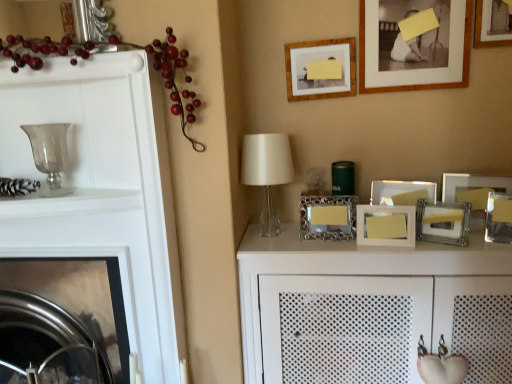
At what (x,y) coordinates should I click in order to perform the action: click on glossy plastic berries at left. Please return your answer as a coordinate pair (x, y). The width and height of the screenshot is (512, 384). Looking at the image, I should click on (174, 81).

Image resolution: width=512 pixels, height=384 pixels. Describe the element at coordinates (354, 303) in the screenshot. I see `white textured cabinet at center` at that location.

This screenshot has height=384, width=512. What do you see at coordinates (398, 190) in the screenshot?
I see `metallic silver picture frame at center-right, the sixth picture frame ordered from the bottom` at bounding box center [398, 190].

Image resolution: width=512 pixels, height=384 pixels. I want to click on wooden picture frame at upper right, positioned as the first picture frame in top-to-bottom order, so click(x=493, y=23).

You are a GUI agent. You are given a task and a screenshot of the screen. Output one action in this format:
    pyautogui.click(x=<x>, y=<y>)
    Task: Click on the glossy plastic berries at left
    The image size is (512, 384).
    Given the screenshot: What is the action you would take?
    pyautogui.click(x=174, y=81)

Between wooden picture frame at upper center, marked as the 7th picture frame in a bottom-to-top arrangement, and transparent glass table lamp at center, which one has larger size?

transparent glass table lamp at center is bigger.

Does wooden picture frame at upper center, arranged as the third picture frame when viewed from the top, turn towards transparent glass table lamp at center?

No, wooden picture frame at upper center, arranged as the third picture frame when viewed from the top, is not oriented towards transparent glass table lamp at center.

Are wooden picture frame at upper center, marked as the 7th picture frame in a bottom-to-top arrangement, and transparent glass table lamp at center making contact?

wooden picture frame at upper center, marked as the 7th picture frame in a bottom-to-top arrangement, and transparent glass table lamp at center are not in contact.

Which of these two, wooden picture frame at upper center, marked as the 7th picture frame in a bottom-to-top arrangement, or transparent glass table lamp at center, stands shorter?

wooden picture frame at upper center, marked as the 7th picture frame in a bottom-to-top arrangement, is shorter.

The height and width of the screenshot is (384, 512). Find the location of `vanity below the transparent glass table lamp at center (from the image's perspective)`. vanity below the transparent glass table lamp at center (from the image's perspective) is located at coordinates (354, 303).

Which of these two, transparent glass table lamp at center or white textured cabinet at center, is wider?

white textured cabinet at center is wider.

From a real-world perspective, is transparent glass table lamp at center under white textured cabinet at center?

→ No, from a real-world perspective, transparent glass table lamp at center is not under white textured cabinet at center.

In the image, is transparent glass table lamp at center positioned in front of or behind white textured cabinet at center?

transparent glass table lamp at center is behind white textured cabinet at center.

Identify the location of the 3rd picture frame behind the wooden picture frame at center-right, the 9th picture frame from the top, counting from the anchor's position. The width and height of the screenshot is (512, 384). (414, 84).

What's the angular difference between wooden picture frame at upper right, arranged as the second picture frame when viewed from the top, and wooden picture frame at center-right, which is the first picture frame in bottom-to-top order,'s facing directions?

The angular difference between wooden picture frame at upper right, arranged as the second picture frame when viewed from the top, and wooden picture frame at center-right, which is the first picture frame in bottom-to-top order, is 8.39 degrees.

From the image's perspective, which one is positioned lower, wooden picture frame at upper right, arranged as the second picture frame when viewed from the top, or wooden picture frame at center-right, the 9th picture frame from the top?

wooden picture frame at center-right, the 9th picture frame from the top, is shown below in the image.

Is wooden picture frame at upper right, the 8th picture frame positioned from the bottom, positioned before wooden picture frame at center-right, which is the first picture frame in bottom-to-top order?

No, the depth of wooden picture frame at upper right, the 8th picture frame positioned from the bottom, is greater than that of wooden picture frame at center-right, which is the first picture frame in bottom-to-top order.

Can you confirm if glossy plastic berries at left is shorter than wooden picture frame at upper right, arranged as the second picture frame when viewed from the top?

No.

From a real-world perspective, relative to wooden picture frame at upper right, the 8th picture frame positioned from the bottom, is glossy plastic berries at left vertically above or below?

Clearly, from a real-world perspective, glossy plastic berries at left is below wooden picture frame at upper right, the 8th picture frame positioned from the bottom.

Considering the points (32, 39) and (463, 85), which point is behind, point (32, 39) or point (463, 85)?

The point (463, 85) is farther.

Is glossy plastic berries at left oriented away from wooden picture frame at upper right, arranged as the second picture frame when viewed from the top?

That's not correct — glossy plastic berries at left is not looking away from wooden picture frame at upper right, arranged as the second picture frame when viewed from the top.

Is wooden picture frame at upper right, arranged as the second picture frame when viewed from the top, completely or partially inside wooden picture frame at upper right, placed as the ninth picture frame when sorted from bottom to top?

No.

Between wooden picture frame at upper right, placed as the ninth picture frame when sorted from bottom to top, and wooden picture frame at upper right, the 8th picture frame positioned from the bottom, which one has smaller width?

wooden picture frame at upper right, the 8th picture frame positioned from the bottom, is thinner.

Does wooden picture frame at upper right, placed as the ninth picture frame when sorted from bottom to top, come behind wooden picture frame at upper right, the 8th picture frame positioned from the bottom?

No, wooden picture frame at upper right, placed as the ninth picture frame when sorted from bottom to top, is closer to the camera.

In the scene shown: Can you confirm if wooden picture frame at upper right, positioned as the first picture frame in top-to-bottom order, is positioned to the right of wooden picture frame at upper right, the 8th picture frame positioned from the bottom?

Yes, wooden picture frame at upper right, positioned as the first picture frame in top-to-bottom order, is to the right of wooden picture frame at upper right, the 8th picture frame positioned from the bottom.

Considering the positions of objects transparent glass table lamp at center and wooden picture frame at upper center, arranged as the third picture frame when viewed from the top, in the image provided, who is more to the right, transparent glass table lamp at center or wooden picture frame at upper center, arranged as the third picture frame when viewed from the top,?

From the viewer's perspective, wooden picture frame at upper center, arranged as the third picture frame when viewed from the top, appears more on the right side.

From the image's perspective, is transparent glass table lamp at center beneath wooden picture frame at upper center, arranged as the third picture frame when viewed from the top?

Yes, from the image's perspective, transparent glass table lamp at center is beneath wooden picture frame at upper center, arranged as the third picture frame when viewed from the top.

Based on the photo, is transparent glass table lamp at center next to wooden picture frame at upper center, arranged as the third picture frame when viewed from the top?

There is a gap between transparent glass table lamp at center and wooden picture frame at upper center, arranged as the third picture frame when viewed from the top.

Where is `candle holder on the right of metallic silver fireplace at left`? This screenshot has height=384, width=512. candle holder on the right of metallic silver fireplace at left is located at coordinates (x=49, y=154).

Based on the photo, from the image's perspective, which is above, metallic silver fireplace at left or transparent glass candle holder at left?

transparent glass candle holder at left.

From a real-world perspective, which object rests below the other?

metallic silver fireplace at left, from a real-world perspective.

Is metallic silver fireplace at left inside the boundaries of transparent glass candle holder at left, or outside?

metallic silver fireplace at left exists outside the volume of transparent glass candle holder at left.

The image size is (512, 384). Identify the location of table lamp below the wooden picture frame at upper center, arranged as the third picture frame when viewed from the top (from a real-world perspective). (267, 172).

The width and height of the screenshot is (512, 384). I want to click on vanity that is on the right side of transparent glass table lamp at center, so click(x=354, y=303).

Based on the photo, estimate the real-world distances between objects in this image. Which object is closer to metallic silver picture frame at center-right, which is the fourth picture frame in top-to-bottom order, wooden picture frame at upper center, marked as the 7th picture frame in a bottom-to-top arrangement, or transparent glass candle holder at left?

wooden picture frame at upper center, marked as the 7th picture frame in a bottom-to-top arrangement, is positioned closer to the anchor metallic silver picture frame at center-right, which is the fourth picture frame in top-to-bottom order.

Looking at the image, which one is located closer to white textured cabinet at center, wooden picture frame at upper right, placed as the ninth picture frame when sorted from bottom to top, or wooden picture frame at center-right, the 9th picture frame from the top?

wooden picture frame at center-right, the 9th picture frame from the top, is positioned closer to the anchor white textured cabinet at center.

Based on their spatial positions, is wooden picture frame at upper right, the 8th picture frame positioned from the bottom, or metallic silver photo frame at center, which is the seventh picture frame from top to bottom, closer to transparent glass table lamp at center?

metallic silver photo frame at center, which is the seventh picture frame from top to bottom, lies closer to transparent glass table lamp at center than the other object.

Looking at the image, which one is located closer to transparent glass candle holder at left, wooden picture frame at upper center, arranged as the third picture frame when viewed from the top, or wooden picture frame at upper right, positioned as the first picture frame in top-to-bottom order?

wooden picture frame at upper center, arranged as the third picture frame when viewed from the top, lies closer to transparent glass candle holder at left than the other object.

From the image, which object appears to be farther from wooden picture frame at center-right, the 9th picture frame from the top, wooden picture frame at upper right, placed as the ninth picture frame when sorted from bottom to top, or transparent glass candle holder at left?

transparent glass candle holder at left is further to wooden picture frame at center-right, the 9th picture frame from the top.

From the image, which object appears to be nearer to wooden picture frame at upper center, arranged as the third picture frame when viewed from the top, wooden picture frame at upper right, placed as the ninth picture frame when sorted from bottom to top, or silver metallic photo frame at center, which appears as the eighth picture frame when viewed from the top?

wooden picture frame at upper right, placed as the ninth picture frame when sorted from bottom to top, is closer to wooden picture frame at upper center, arranged as the third picture frame when viewed from the top.

Considering their positions, is white textured cabinet at center positioned closer to metallic silver picture frame at right, the sixth picture frame viewed from the top, than wooden picture frame at upper right, arranged as the second picture frame when viewed from the top?

white textured cabinet at center.

Based on their spatial positions, is wooden picture frame at center-right, which is the first picture frame in bottom-to-top order, or glossy plastic berries at left further from metallic silver picture frame at center-right, which is the fourth picture frame in top-to-bottom order?

glossy plastic berries at left.

This screenshot has height=384, width=512. Find the location of `fruit situated between transparent glass candle holder at left and transparent glass table lamp at center from left to right`. fruit situated between transparent glass candle holder at left and transparent glass table lamp at center from left to right is located at coordinates (174, 81).

Identify the location of vanity between glossy plastic berries at left and wooden picture frame at upper right, arranged as the second picture frame when viewed from the top. Image resolution: width=512 pixels, height=384 pixels. (354, 303).

Where is `candle holder between metallic silver fireplace at left and wooden picture frame at upper right, arranged as the second picture frame when viewed from the top, in the horizontal direction`? Image resolution: width=512 pixels, height=384 pixels. candle holder between metallic silver fireplace at left and wooden picture frame at upper right, arranged as the second picture frame when viewed from the top, in the horizontal direction is located at coordinates (49, 154).

Locate an element on the screen. This screenshot has height=384, width=512. table lamp between wooden picture frame at upper right, arranged as the second picture frame when viewed from the top, and wooden picture frame at center-right, the 9th picture frame from the top, in the up-down direction is located at coordinates (267, 172).